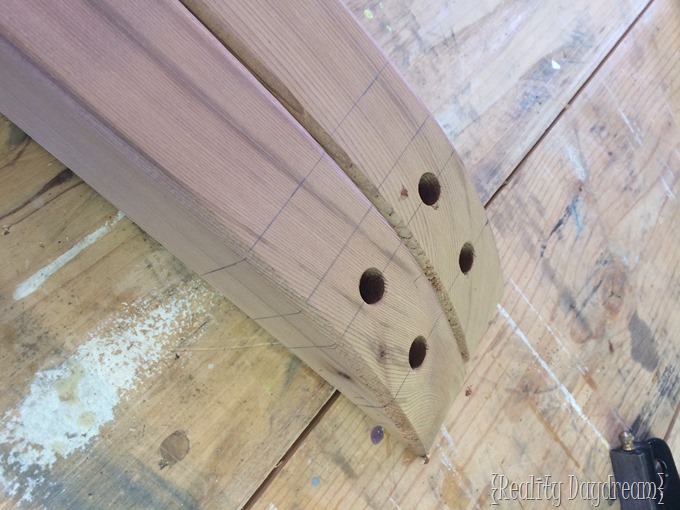
At what (x,y) coordinates should I click in order to perform the action: click on knots in the wood. Please return your answer as a coordinate pair (x, y). Looking at the image, I should click on (613, 298), (377, 432), (167, 444), (58, 178), (18, 132), (666, 379).